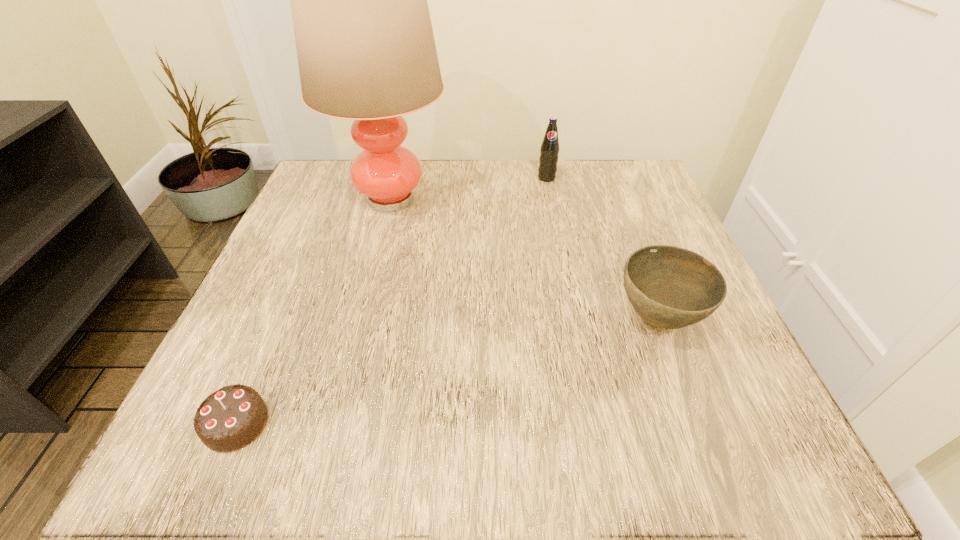
At what (x,y) coordinates should I click in order to perform the action: click on vacant point located between the second object from right to left and the lamp. Please return your answer as a coordinate pair (x, y). The width and height of the screenshot is (960, 540). Looking at the image, I should click on (469, 188).

The image size is (960, 540). In order to click on vacant area that lies between the third object from left to right and the rightmost object in this screenshot , I will do `click(602, 248)`.

The width and height of the screenshot is (960, 540). Find the location of `empty location between the nearest object and the third object from left to right`. empty location between the nearest object and the third object from left to right is located at coordinates (392, 301).

At what (x,y) coordinates should I click in order to perform the action: click on free point between the tallest object and the third shortest object. Please return your answer as a coordinate pair (x, y). This screenshot has width=960, height=540. Looking at the image, I should click on (469, 188).

Where is `vacant area that lies between the chocolate cake and the third shortest object`? The height and width of the screenshot is (540, 960). vacant area that lies between the chocolate cake and the third shortest object is located at coordinates (392, 301).

The width and height of the screenshot is (960, 540). What are the coordinates of `the third closest object relative to the third shortest object` in the screenshot? It's located at (229, 419).

Identify the location of object that is the third closest to the lamp. This screenshot has height=540, width=960. (229, 419).

This screenshot has height=540, width=960. Identify the location of free space that satisfies the following two spatial constraints: 1. on the front label of the bowl; 2. on the right side of the second tallest object. (575, 319).

Image resolution: width=960 pixels, height=540 pixels. In order to click on vacant area in the image that satisfies the following two spatial constraints: 1. on the front label of the third object from left to right; 2. on the right side of the rightmost object in this screenshot , I will do `click(575, 319)`.

In order to click on vacant point that satisfies the following two spatial constraints: 1. on the front label of the bowl; 2. on the left side of the third object from left to right in this screenshot , I will do `click(575, 319)`.